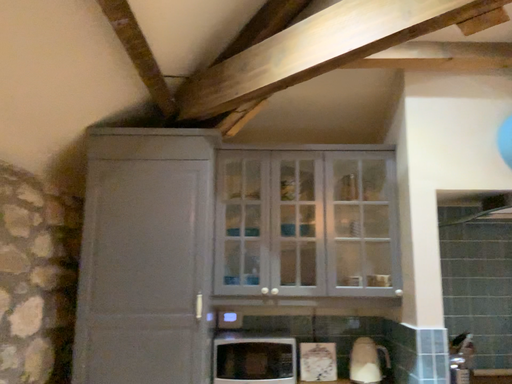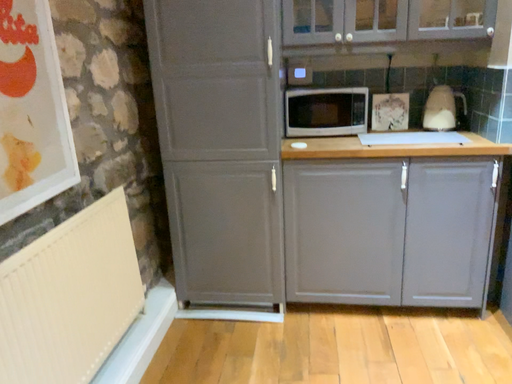
Question: Which way did the camera rotate in the video?

Choices:
 (A) rotated downward
 (B) rotated upward

Answer: (A)